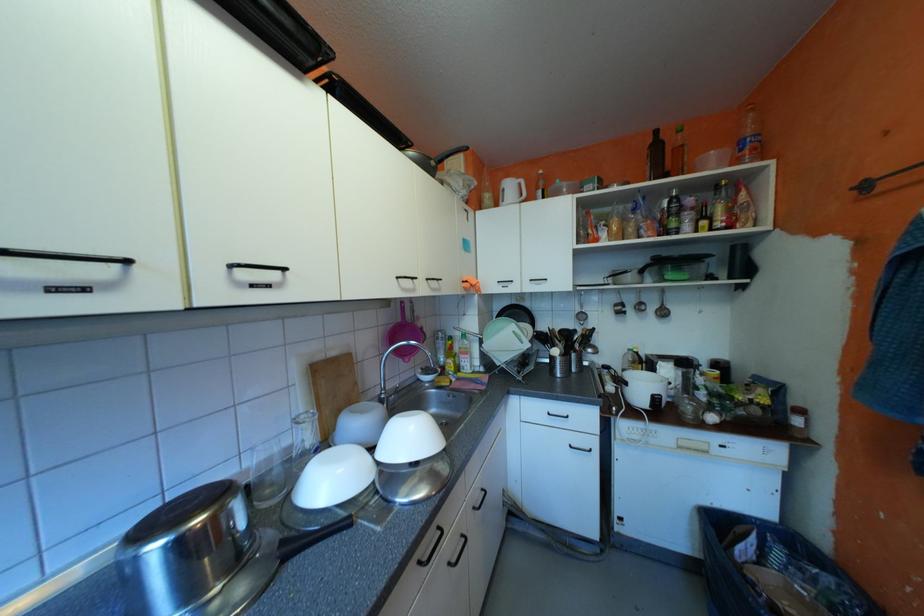
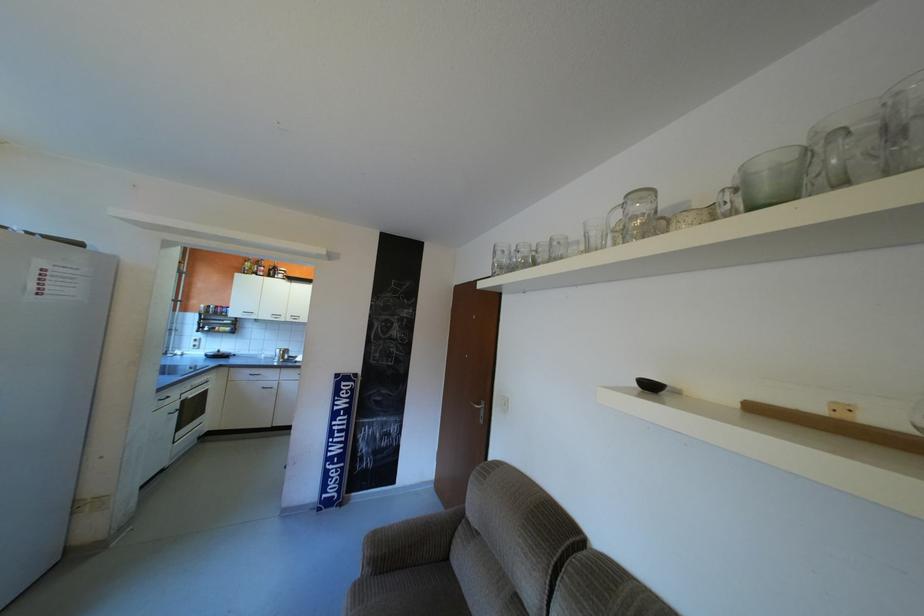
Locate, in the second image, the point that corresponds to the point at 231,293 in the first image.

(300, 318)